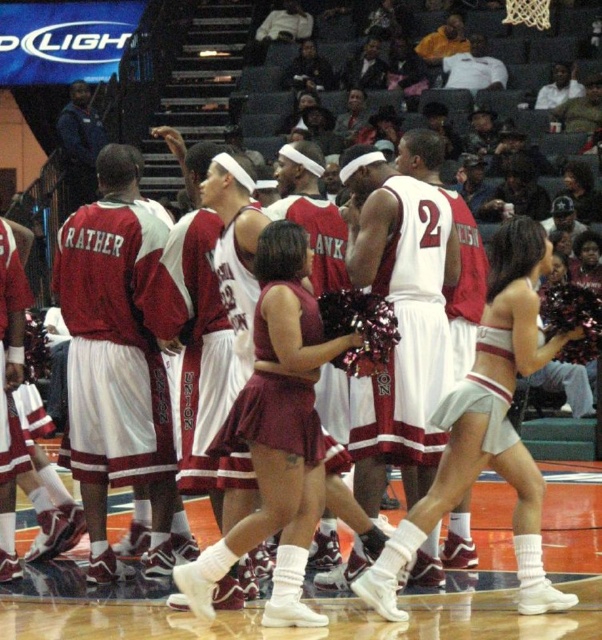
Question: Is maroon jersey at center to the left of white jersey at center from the viewer's perspective?

Choices:
 (A) yes
 (B) no

Answer: (A)

Question: Is maroon jersey at center bigger than white jersey at center?

Choices:
 (A) no
 (B) yes

Answer: (A)

Question: Which of the following is the farthest from the observer?

Choices:
 (A) white jersey at center
 (B) maroon jersey at center

Answer: (B)

Question: Does maroon jersey at center have a larger size compared to white jersey at center?

Choices:
 (A) no
 (B) yes

Answer: (A)